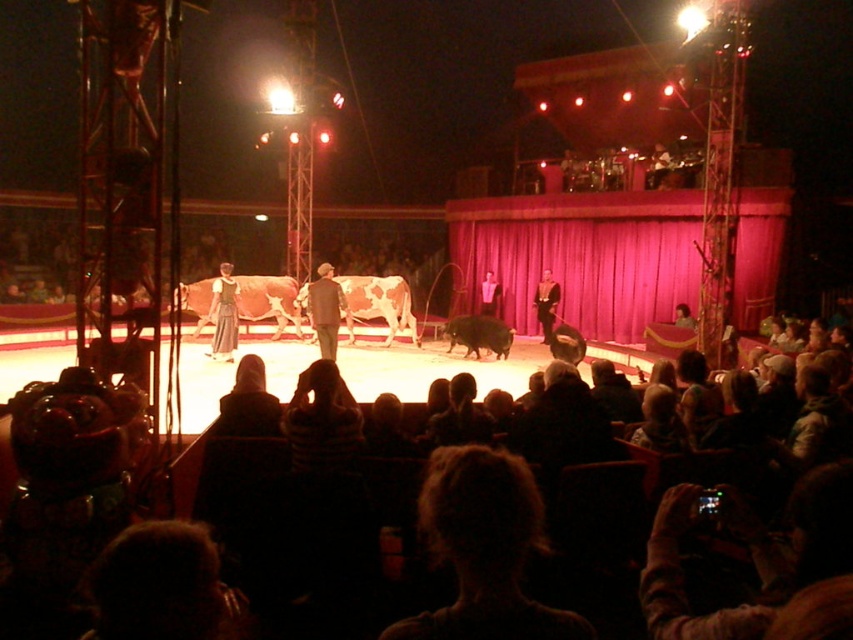
Who is more distant from viewer, (x=318, y=324) or (x=550, y=296)?

Positioned behind is point (x=550, y=296).

Is point (311, 284) farther from camera compared to point (552, 289)?

No, (311, 284) is closer to viewer.

The height and width of the screenshot is (640, 853). Describe the element at coordinates (325, 308) in the screenshot. I see `dark gray suit at center` at that location.

This screenshot has width=853, height=640. What are the coordinates of `dark gray suit at center` in the screenshot? It's located at (325, 308).

Does formal black suit at center have a larger size compared to smooth black suit at center?

Yes, formal black suit at center is bigger than smooth black suit at center.

The width and height of the screenshot is (853, 640). I want to click on formal black suit at center, so click(x=546, y=304).

Image resolution: width=853 pixels, height=640 pixels. Identify the location of formal black suit at center. (546, 304).

Who is higher up, dark brown hair at center or smooth black suit at center?

smooth black suit at center

Does dark brown hair at center have a lesser width compared to smooth black suit at center?

Incorrect, dark brown hair at center's width is not less than smooth black suit at center's.

Is point (454, 516) positioned after point (488, 282)?

No, (454, 516) is in front of (488, 282).

Image resolution: width=853 pixels, height=640 pixels. What are the coordinates of `dark brown hair at center` in the screenshot? It's located at (485, 548).